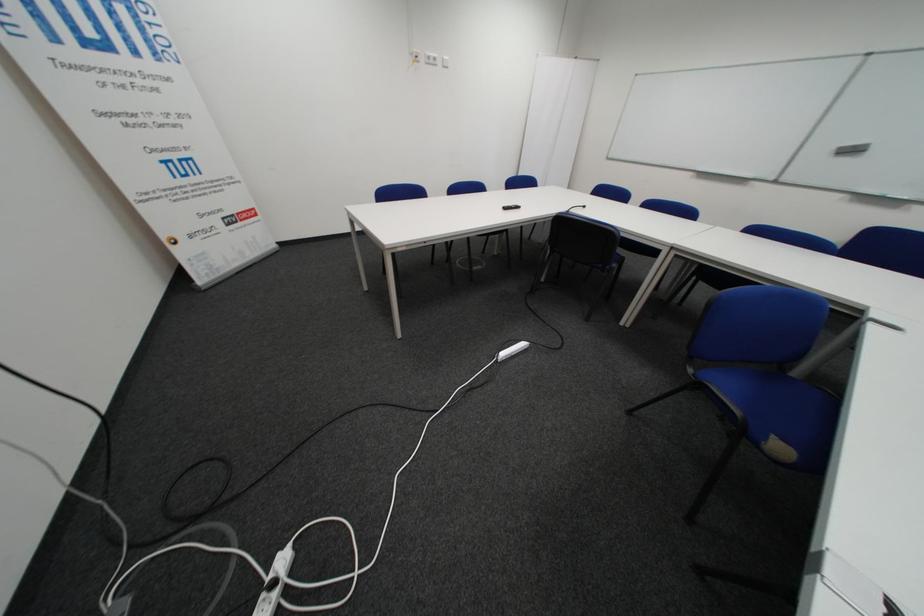
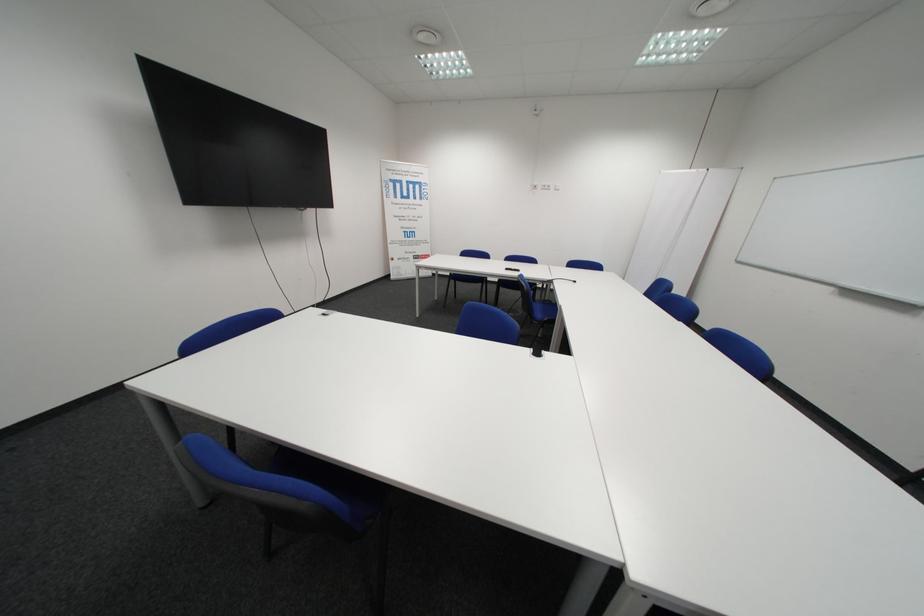
Locate, in the second image, the point that corresponds to [517,209] in the first image.

(518, 270)